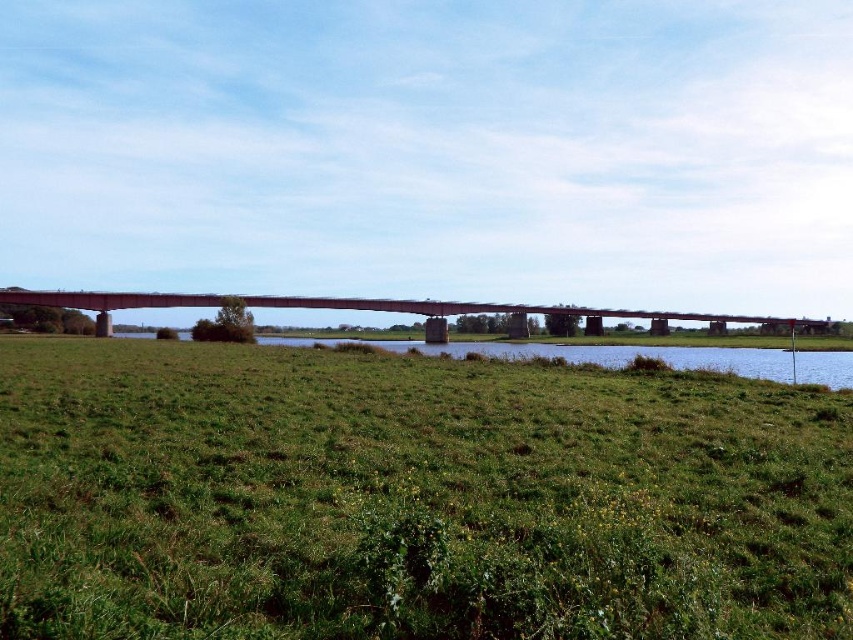
You are a small drone that is 1 meter tall. You are flying over the green grassy field at lower center and want to land on the concrete bridge at center. Can you safely land there without hitting the bridge?

The concrete bridge at center is much taller than the green grassy field at lower center, so the drone cannot safely land there without hitting the bridge.

You are a gardener who needs to mow the grass in the green grassy field at center and the green grassy field at lower center. Which area requires more frequent mowing due to faster growth?

The green grassy field at lower center requires more frequent mowing because it is taller than the green grassy field at center, indicating faster growth.

You are planning to cross the concrete bridge at center with a vehicle that is 2 meters wide. The green grassy field at lower center is also accessible. Which path has a wider passage for your vehicle?

The concrete bridge at center has a larger width than the green grassy field at lower center, so the concrete bridge at center can accommodate the 2 meter wide vehicle more appropriately.